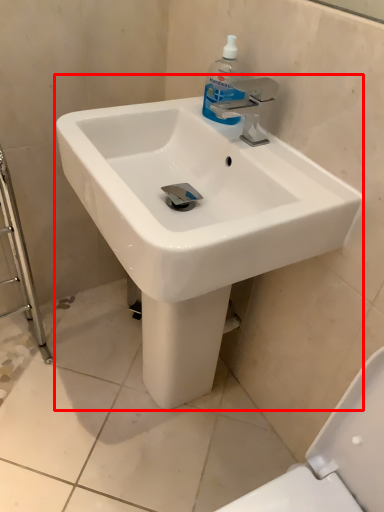
Question: From the image's perspective, what is the correct spatial relationship of sink (annotated by the red box) in relation to cleaning product?

Choices:
 (A) below
 (B) above

Answer: (A)